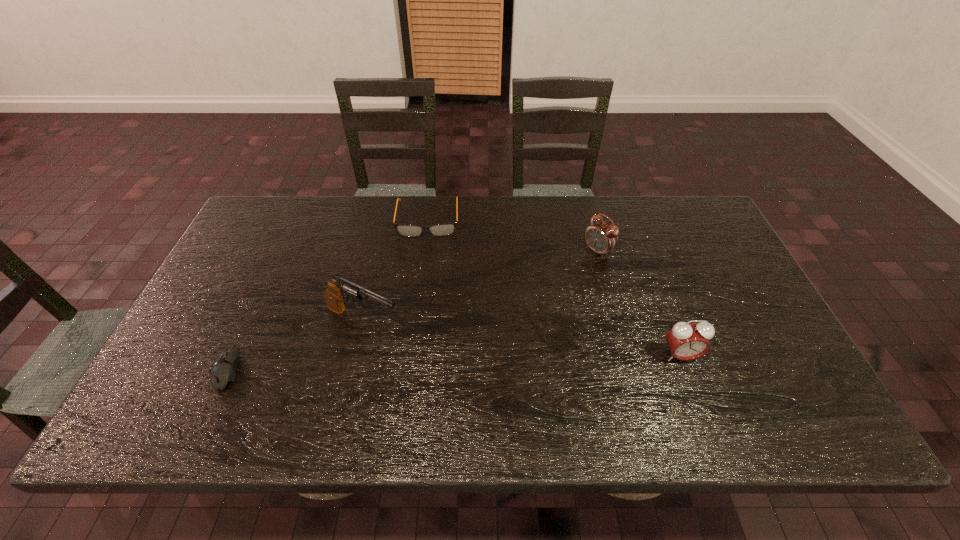
Find the location of a particular element. This screenshot has width=960, height=540. vacant region located 0.050m on the clock face of the right alarm clock is located at coordinates (690, 383).

Identify the location of free space located 0.210m along the barrel of the third farthest object. (470, 366).

The height and width of the screenshot is (540, 960). Find the location of `vacant area situated 0.130m along the barrel of the third farthest object`. vacant area situated 0.130m along the barrel of the third farthest object is located at coordinates point(442,352).

Identify the location of free space located along the barrel of the third farthest object. (418, 341).

This screenshot has height=540, width=960. What are the coordinates of `free space located on the front-facing side of the farthest object` in the screenshot? It's located at (422, 309).

Locate an element on the screen. free space located 0.220m on the front-facing side of the farthest object is located at coordinates (423, 292).

Find the location of `vacant area situated 0.240m on the front-facing side of the farthest object`. vacant area situated 0.240m on the front-facing side of the farthest object is located at coordinates (423, 298).

Locate an element on the screen. vacant area located on the face of the second object from right to left is located at coordinates (502, 316).

This screenshot has height=540, width=960. Identify the location of blank space located on the face of the second object from right to left. (572, 269).

This screenshot has width=960, height=540. Identify the location of free space located 0.310m on the face of the second object from right to left. (511, 310).